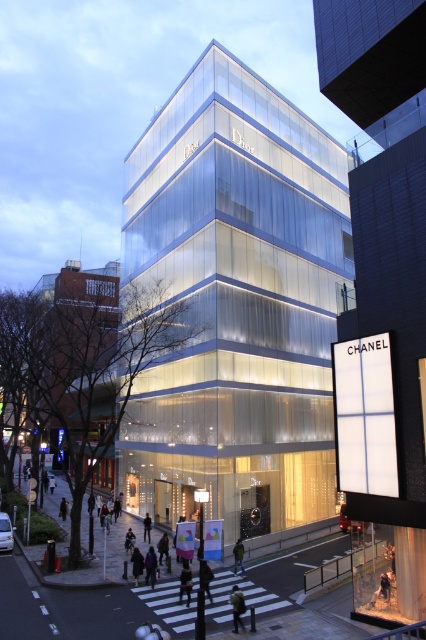
Question: Is dark gray fabric at lower center positioned behind dark purple coat at center?

Choices:
 (A) no
 (B) yes

Answer: (A)

Question: Which of the following is the closest to the observer?

Choices:
 (A) transparent glass building at center
 (B) dark brown leather backpack at lower center
 (C) dark gray fabric at lower center

Answer: (B)

Question: Which object is closer to the camera taking this photo?

Choices:
 (A) dark purple coat at center
 (B) transparent glass building at center
 (C) dark brown leather backpack at lower center

Answer: (C)

Question: In this image, where is dark brown leather backpack at lower center located relative to dark gray fabric at lower center?

Choices:
 (A) above
 (B) below

Answer: (A)

Question: Does transparent glass building at center appear on the left side of dark blue jacket at lower center?

Choices:
 (A) no
 (B) yes

Answer: (A)

Question: Which point is closer to the camera?

Choices:
 (A) transparent glass building at center
 (B) dark gray fabric at lower center
 (C) dark blue jacket at lower center
 (D) dark brown leather backpack at lower center

Answer: (D)